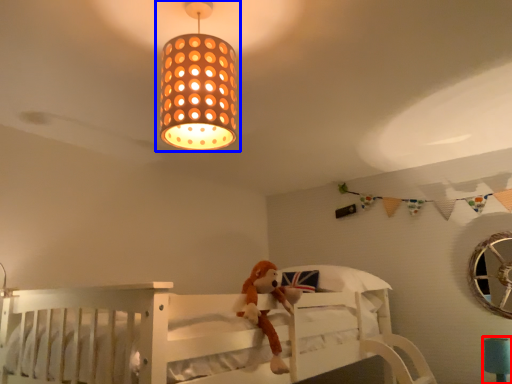
Question: Among these objects, which one is nearest to the camera, table lamp (highlighted by a red box) or lamp (highlighted by a blue box)?

Choices:
 (A) table lamp
 (B) lamp

Answer: (B)